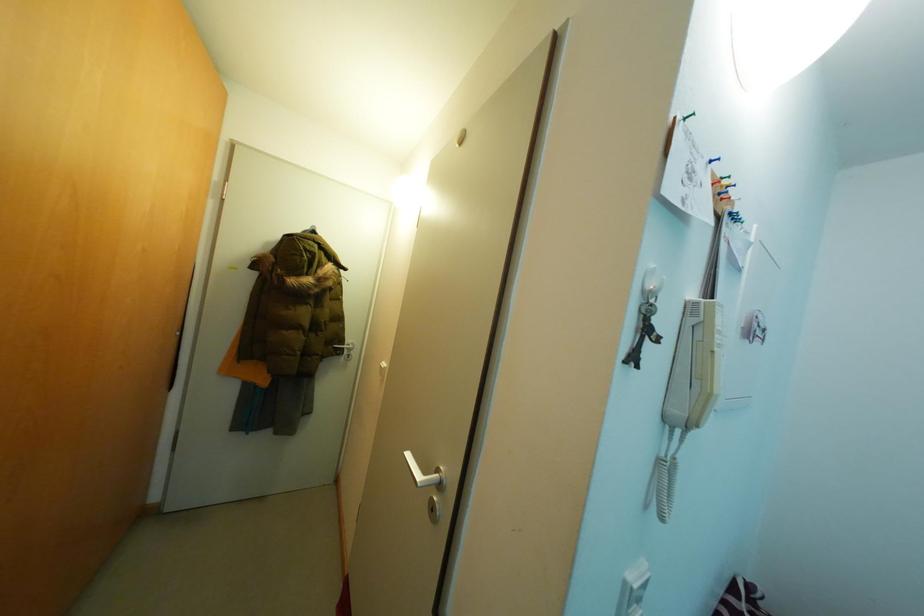
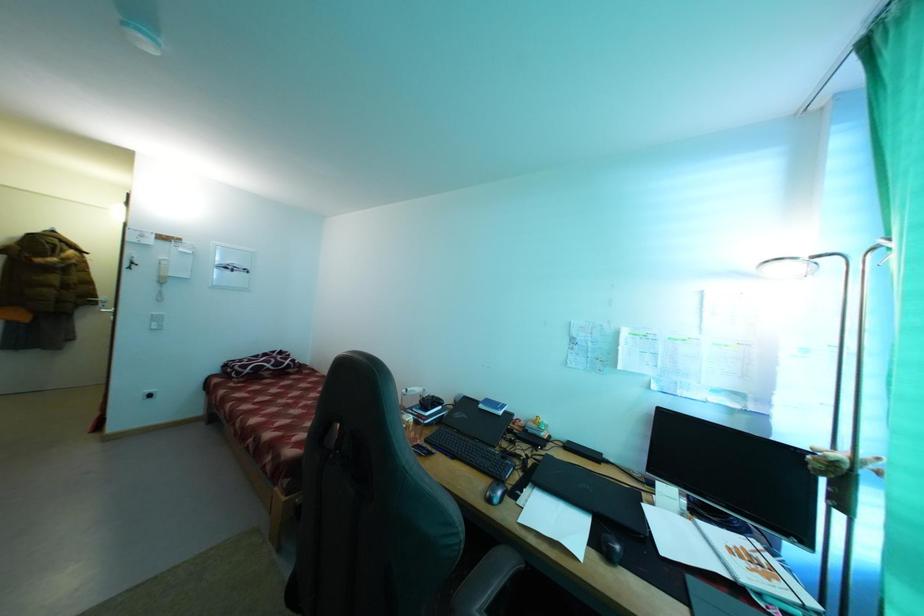
Which direction would the cameraman need to move to produce the second image?

The cameraman moved toward right, backward.